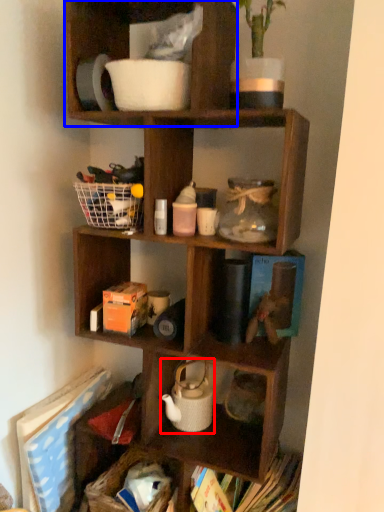
Question: Which object is closer to the camera taking this photo, tea pot (highlighted by a red box) or shelf (highlighted by a blue box)?

Choices:
 (A) tea pot
 (B) shelf

Answer: (B)